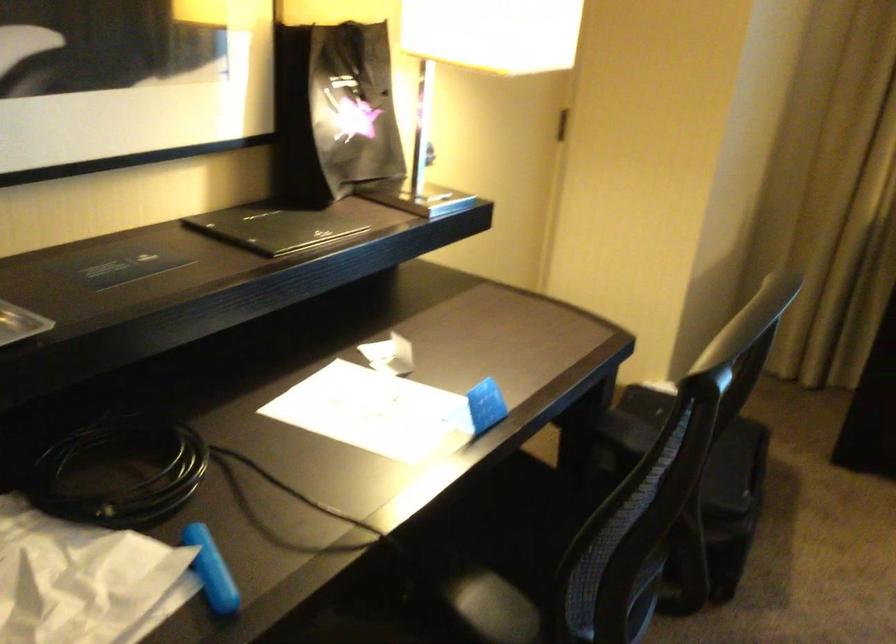
This screenshot has height=644, width=896. Identify the location of chair sitting surface. (709, 618).